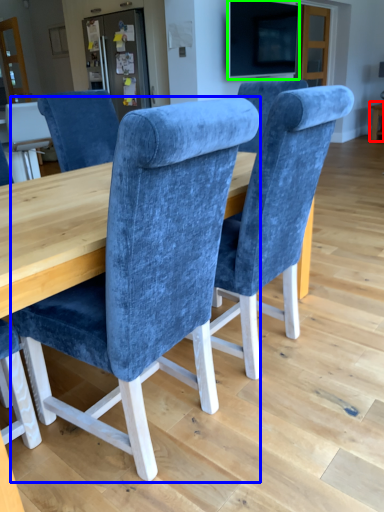
Question: Considering the real-world distances, which object is closest to table (highlighted by a red box)? chair (highlighted by a blue box) or television (highlighted by a green box).

Choices:
 (A) chair
 (B) television

Answer: (B)